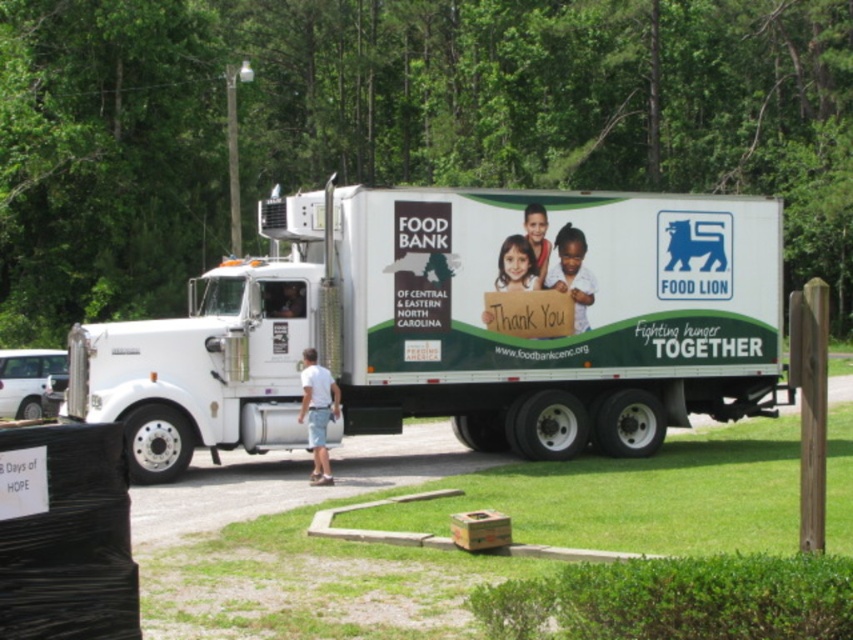
Between point (689, 369) and point (45, 596), which one is positioned behind?

The point (689, 369) is more distant.

Is white matte truck at center positioned before black plastic sign at lower left?

No, white matte truck at center is behind black plastic sign at lower left.

Is point (646, 406) less distant than point (115, 429)?

No, it is behind (115, 429).

The image size is (853, 640). Find the location of `white matte truck at center`. white matte truck at center is located at coordinates (456, 324).